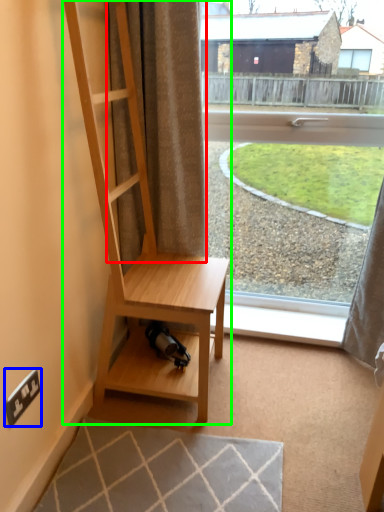
Question: Which object is positioned farthest from curtain (highlighted by a red box)? Select from electric outlet (highlighted by a blue box) and shelf (highlighted by a green box).

Choices:
 (A) electric outlet
 (B) shelf

Answer: (A)